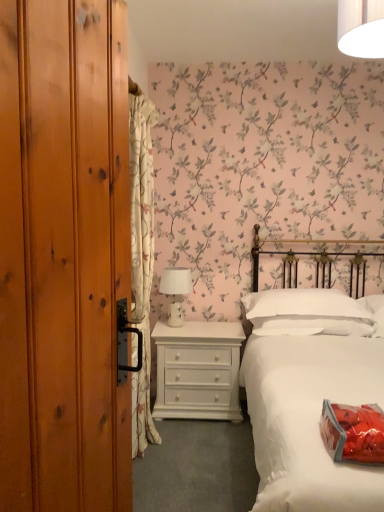
This screenshot has width=384, height=512. What are the coordinates of `white floral fabric curtain at left` in the screenshot? It's located at (142, 259).

This screenshot has width=384, height=512. What do you see at coordinates (198, 370) in the screenshot?
I see `white painted wood chest of drawers at center` at bounding box center [198, 370].

At what (x,y) coordinates should I click in order to perform the action: click on white ceramic table lamp at center. Please return your answer as a coordinate pair (x, y). The height and width of the screenshot is (512, 384). Looking at the image, I should click on (176, 291).

Is white floral fabric curtain at left spatially inside white soft pillow at center, or outside of it?

The correct answer is: outside.

Based on the photo, is the surface of white floral fabric curtain at left in direct contact with white soft pillow at center?

white floral fabric curtain at left and white soft pillow at center are not in contact.

From a real-world perspective, is white floral fabric curtain at left under white soft pillow at center?

Incorrect, from a real-world perspective, white floral fabric curtain at left is higher than white soft pillow at center.

Who is smaller, white ceramic table lamp at center or white glossy dresser at center?

white ceramic table lamp at center is smaller.

Does white ceramic table lamp at center lie in front of white glossy dresser at center?

No, white ceramic table lamp at center is further to the viewer.

Is white ceramic table lamp at center taller or shorter than white glossy dresser at center?

white ceramic table lamp at center is shorter than white glossy dresser at center.

Looking at this image, is white ceramic table lamp at center next to white glossy dresser at center?

No, white ceramic table lamp at center is not in contact with white glossy dresser at center.

Is white soft pillow at center surrounding white painted wood chest of drawers at center?

That's incorrect, white painted wood chest of drawers at center is not inside white soft pillow at center.

Are white soft pillow at center and white painted wood chest of drawers at center beside each other?

white soft pillow at center and white painted wood chest of drawers at center are clearly separated.

Is white soft pillow at center behind white painted wood chest of drawers at center?

No, white soft pillow at center is closer to the viewer.

From the image's perspective, would you say white soft pillow at center is shown under white painted wood chest of drawers at center?

No, from the image's perspective, white soft pillow at center is not beneath white painted wood chest of drawers at center.

From the picture: Is white soft pillow at center at the left side of white glossy dresser at center?

In fact, white soft pillow at center is to the right of white glossy dresser at center.

How different are the orientations of white soft pillow at center and white glossy dresser at center in degrees?

68.5 degrees separate the facing orientations of white soft pillow at center and white glossy dresser at center.

Considering the sizes of white soft pillow at center and white glossy dresser at center in the image, is white soft pillow at center wider or thinner than white glossy dresser at center?

Considering their sizes, white soft pillow at center looks broader than white glossy dresser at center.

Is white soft pillow at center taller than white glossy dresser at center?

No.

Choose the correct answer: Is white floral fabric curtain at left inside white ceramic table lamp at center or outside it?

white floral fabric curtain at left is not enclosed by white ceramic table lamp at center.

Considering the positions of objects white floral fabric curtain at left and white ceramic table lamp at center in the image provided, who is behind, white floral fabric curtain at left or white ceramic table lamp at center?

white ceramic table lamp at center.

Which object is wider, white floral fabric curtain at left or white ceramic table lamp at center?

white ceramic table lamp at center is wider.

Does white floral fabric curtain at left appear on the right side of white ceramic table lamp at center?

No.

Identify the location of table lamp behind the white glossy dresser at center. (176, 291).

Which is more to the right, white glossy dresser at center or white ceramic table lamp at center?

white ceramic table lamp at center.

In the scene shown: Which of these two, white glossy dresser at center or white ceramic table lamp at center, is thinner?

white glossy dresser at center.

Is white glossy dresser at center facing towards white ceramic table lamp at center?

No.

Looking at this image, does white painted wood chest of drawers at center touch white soft pillow at center?

No, white painted wood chest of drawers at center is not beside white soft pillow at center.

Locate an element on the screen. The image size is (384, 512). chest of drawers behind the white soft pillow at center is located at coordinates (198, 370).

Considering their positions, is white painted wood chest of drawers at center located in front of or behind white soft pillow at center?

white painted wood chest of drawers at center is positioned farther from the viewer than white soft pillow at center.

Is white soft pillow at center at the back of white painted wood chest of drawers at center?

white painted wood chest of drawers at center is not turned away from white soft pillow at center.

Identify the location of curtain in front of the white soft pillow at center. (142, 259).

Where is `dresser on the left of white ceramic table lamp at center`? This screenshot has height=512, width=384. dresser on the left of white ceramic table lamp at center is located at coordinates (63, 255).

Considering their positions, is white painted wood chest of drawers at center positioned closer to white ceramic table lamp at center than white soft pillow at center?

white painted wood chest of drawers at center lies closer to white ceramic table lamp at center than the other object.

Looking at the image, which one is located closer to white floral fabric curtain at left, white painted wood chest of drawers at center or white ceramic table lamp at center?

white painted wood chest of drawers at center is closer to white floral fabric curtain at left.

From the picture: Which object lies nearer to the anchor point white ceramic table lamp at center, white cotton bed at center or white glossy dresser at center?

white cotton bed at center is closer to white ceramic table lamp at center.

From the image, which object appears to be nearer to white cotton bed at center, white glossy dresser at center or white floral fabric curtain at left?

Based on the image, white floral fabric curtain at left appears to be nearer to white cotton bed at center.

Considering their positions, is white glossy dresser at center positioned closer to white ceramic table lamp at center than white soft pillow at center?

white soft pillow at center lies closer to white ceramic table lamp at center than the other object.

Estimate the real-world distances between objects in this image. Which object is further from white cotton bed at center, white painted wood chest of drawers at center or white soft pillow at center?

white painted wood chest of drawers at center is further to white cotton bed at center.

Based on their spatial positions, is white painted wood chest of drawers at center or white ceramic table lamp at center closer to white soft pillow at center?

Among the two, white painted wood chest of drawers at center is located nearer to white soft pillow at center.

Based on their spatial positions, is white soft pillow at center or white floral fabric curtain at left closer to white glossy dresser at center?

white floral fabric curtain at left.

Find the location of a particular element. The image size is (384, 512). table lamp located between white floral fabric curtain at left and white soft pillow at center in the left-right direction is located at coordinates (176, 291).

Identify the location of pillow between white cotton bed at center and white painted wood chest of drawers at center in the front-back direction. (306, 313).

Image resolution: width=384 pixels, height=512 pixels. In order to click on curtain between white cotton bed at center and white soft pillow at center in the front-back direction in this screenshot , I will do `click(142, 259)`.

The width and height of the screenshot is (384, 512). Find the location of `bed located between white glossy dresser at center and white floral fabric curtain at left in the depth direction`. bed located between white glossy dresser at center and white floral fabric curtain at left in the depth direction is located at coordinates [310, 395].